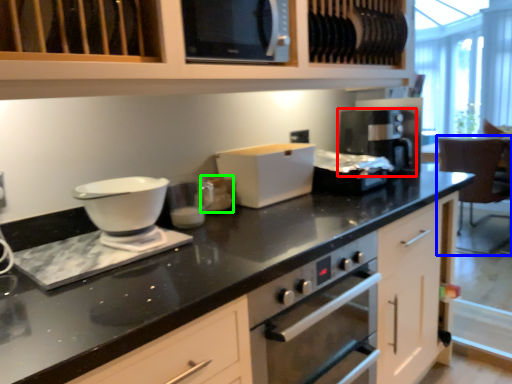
Question: Estimate the real-world distances between objects in this image. Which object is farther from coffee machine (highlighted by a red box), chair (highlighted by a blue box) or appliance (highlighted by a green box)?

Choices:
 (A) chair
 (B) appliance

Answer: (A)